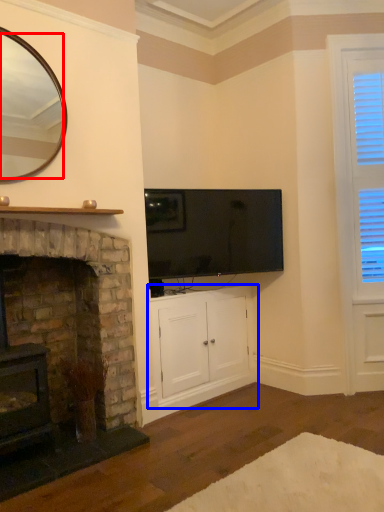
Question: Which point is closer to the camera, mirror (highlighted by a red box) or cabinetry (highlighted by a blue box)?

Choices:
 (A) mirror
 (B) cabinetry

Answer: (A)